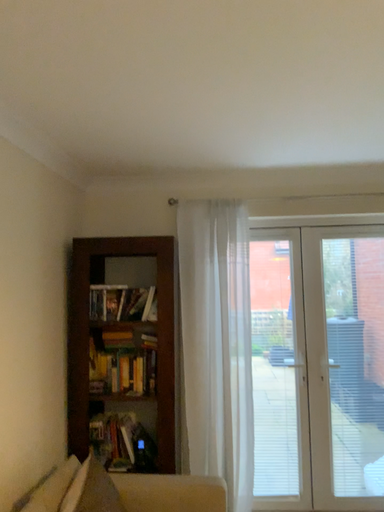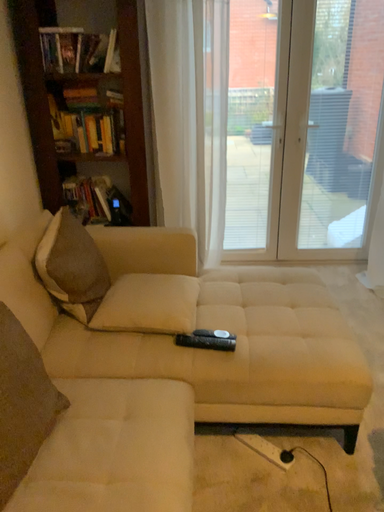
Question: How did the camera likely rotate when shooting the video?

Choices:
 (A) rotated downward
 (B) rotated upward

Answer: (A)